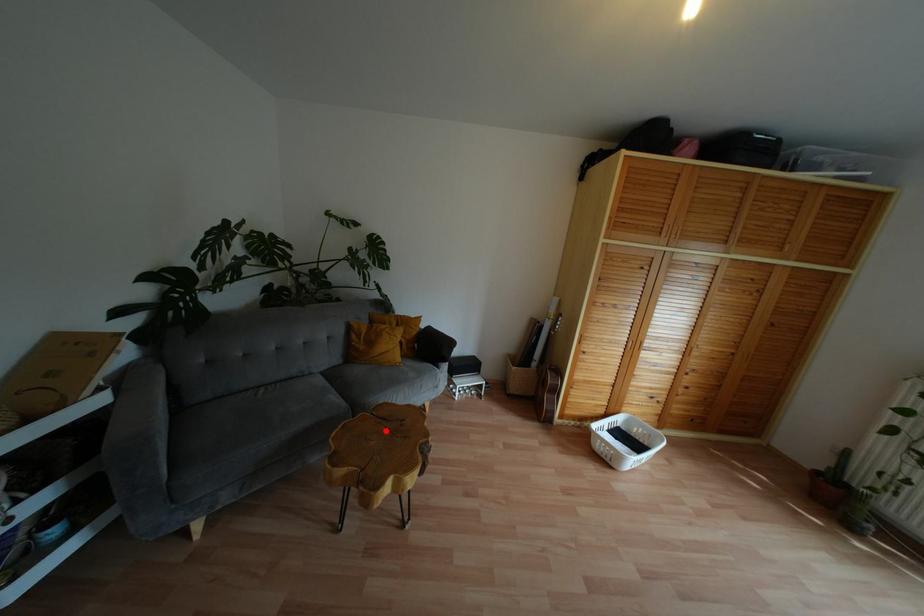
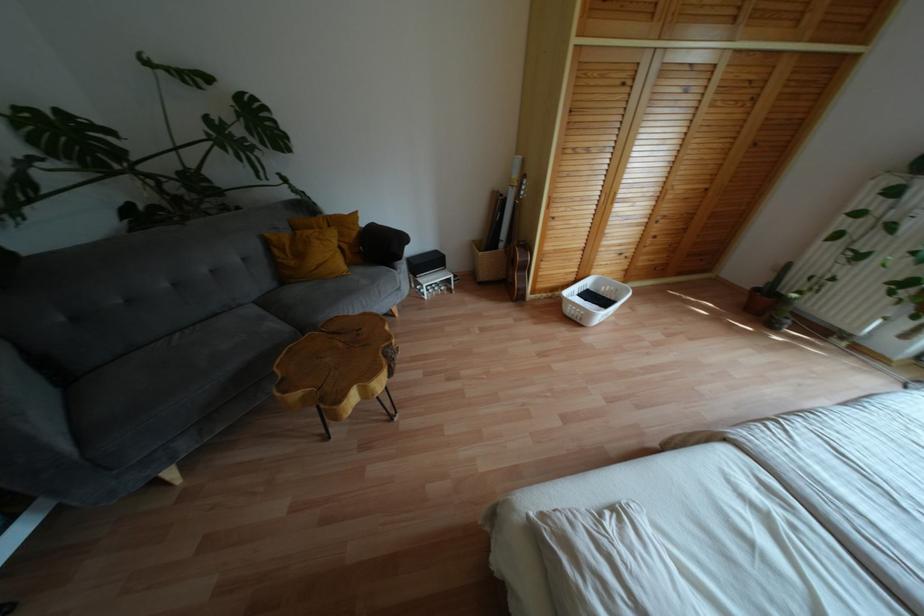
Find the pixel in the second image that matches the highlighted location in the first image.

(341, 344)